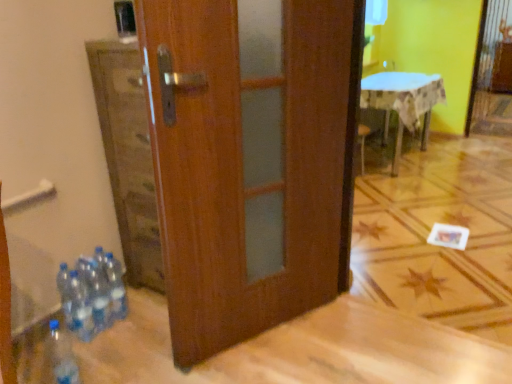
Where is `unoccupied space behind clear plastic bottles at lower left, acting as the 1th bottle starting from the back`? The width and height of the screenshot is (512, 384). unoccupied space behind clear plastic bottles at lower left, acting as the 1th bottle starting from the back is located at coordinates (134, 301).